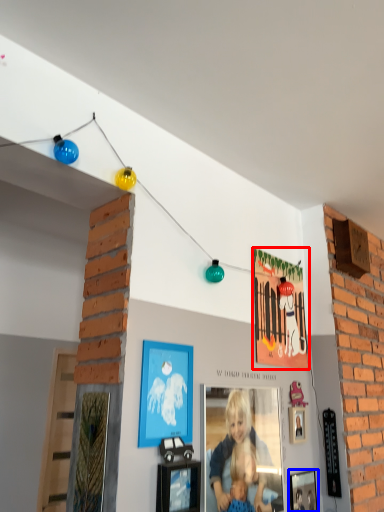
Question: Among these objects, which one is farthest to the camera, picture frame (highlighted by a red box) or picture frame (highlighted by a blue box)?

Choices:
 (A) picture frame
 (B) picture frame

Answer: (A)